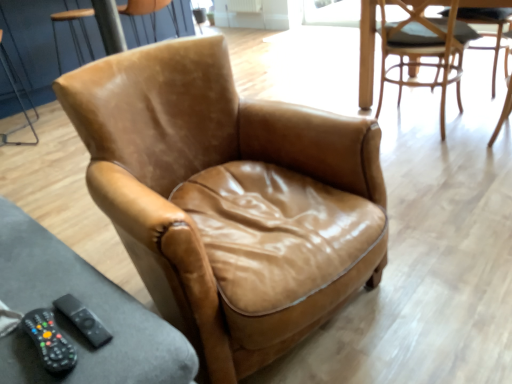
Question: Is black plastic remote at lower left turned away from light brown leather chair at upper right, which is the second chair in back-to-front order?

Choices:
 (A) no
 (B) yes

Answer: (A)

Question: From a real-world perspective, is black plastic remote at lower left physically below light brown leather chair at upper right, acting as the 2th chair starting from the front?

Choices:
 (A) no
 (B) yes

Answer: (A)

Question: Is black plastic remote at lower left shorter than light brown leather chair at upper right, which is the second chair in back-to-front order?

Choices:
 (A) yes
 (B) no

Answer: (A)

Question: Is black plastic remote at lower left positioned far away from light brown leather chair at upper right, acting as the 2th chair starting from the front?

Choices:
 (A) yes
 (B) no

Answer: (A)

Question: Is black plastic remote at lower left taller than light brown leather chair at upper right, the third chair in the left-to-right sequence?

Choices:
 (A) no
 (B) yes

Answer: (A)

Question: Is black plastic remote at lower left smaller than light brown leather chair at upper right, which ranks as the 1th chair in right-to-left order?

Choices:
 (A) no
 (B) yes

Answer: (B)

Question: Is black rubber remote control at lower left further to camera compared to black plastic remote at lower left?

Choices:
 (A) yes
 (B) no

Answer: (B)

Question: Considering the relative sizes of black rubber remote control at lower left and black plastic remote at lower left in the image provided, is black rubber remote control at lower left wider than black plastic remote at lower left?

Choices:
 (A) no
 (B) yes

Answer: (B)

Question: Is black rubber remote control at lower left not near black plastic remote at lower left?

Choices:
 (A) no
 (B) yes

Answer: (A)

Question: From the image's perspective, is black rubber remote control at lower left below black plastic remote at lower left?

Choices:
 (A) yes
 (B) no

Answer: (A)

Question: Can you confirm if black rubber remote control at lower left is positioned to the left of black plastic remote at lower left?

Choices:
 (A) yes
 (B) no

Answer: (A)

Question: Is black rubber remote control at lower left next to black plastic remote at lower left and touching it?

Choices:
 (A) yes
 (B) no

Answer: (A)

Question: Is brown leather armchair at upper left, the 1th chair when ordered from back to front, smaller than black plastic remote at lower left?

Choices:
 (A) yes
 (B) no

Answer: (B)